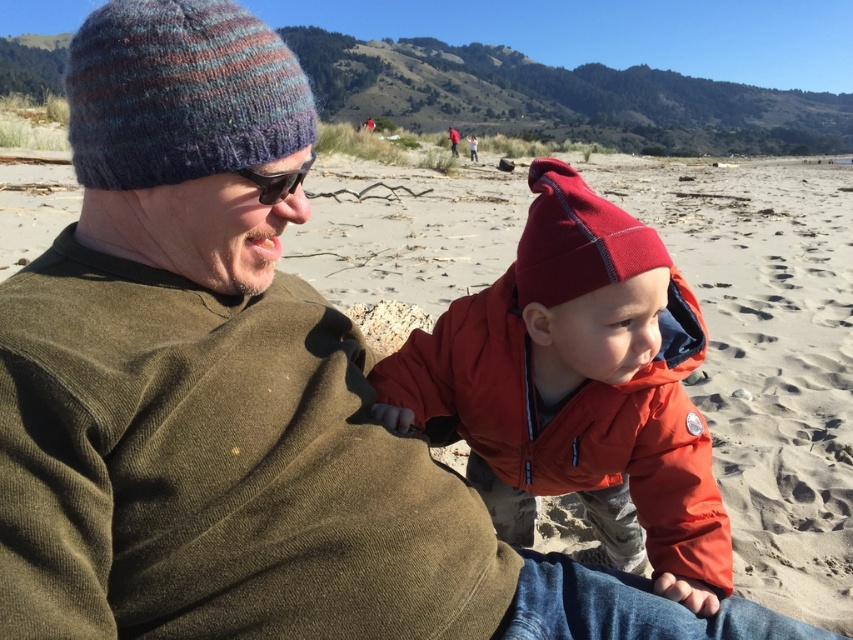
You are standing at the point labeled as point (578, 388) on the beach. You see a matte orange jacket at center. Is the matte orange jacket closer to you or further away compared to the point you are standing at?

The matte orange jacket at center is located at point (578, 388), which is the same position you are standing at. Therefore, the matte orange jacket at center is neither closer nor further away from your current position.

You are a photographer trying to capture a photo of the matte orange jacket at center and the multicolored knitted beanie at upper left. Which object should you focus on first if you want to ensure both are in focus, considering their sizes in the frame?

The matte orange jacket at center is taller than the multicolored knitted beanie at upper left, so you should focus on the matte orange jacket at center first as it is larger in the frame.

You are a photographer trying to capture the perfect shot of the matte orange jacket at center. You notice a point marked at coordinates (578, 388). Based on the scene description, where exactly is this point located relative to the matte orange jacket at center?

The point at coordinates (578, 388) corresponds exactly to the location of the matte orange jacket at center, so it is located precisely at the center of the jacket.